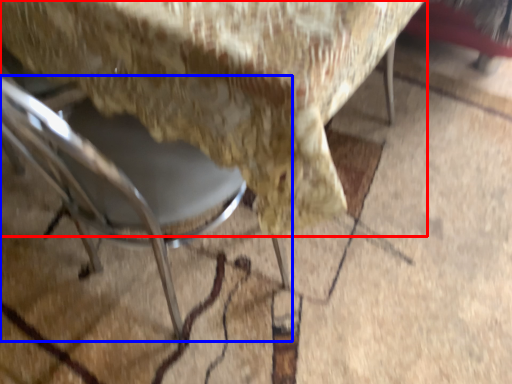
Question: Which point is further to the camera, chair (highlighted by a red box) or chair (highlighted by a blue box)?

Choices:
 (A) chair
 (B) chair

Answer: (A)